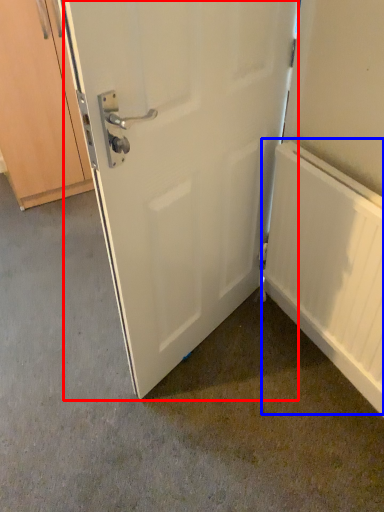
Question: Which object is further to the camera taking this photo, door (highlighted by a red box) or radiator (highlighted by a blue box)?

Choices:
 (A) door
 (B) radiator

Answer: (B)